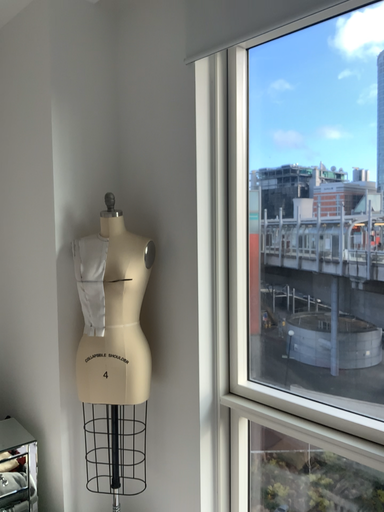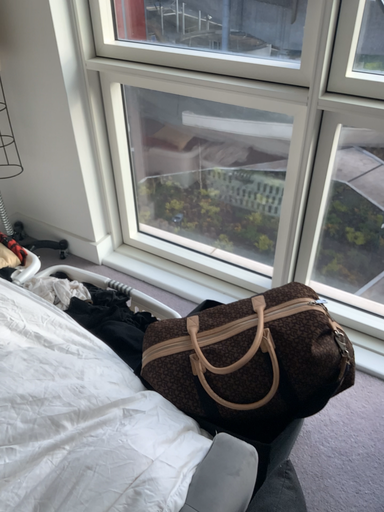
Question: Which way did the camera rotate in the video?

Choices:
 (A) rotated left
 (B) rotated right

Answer: (B)